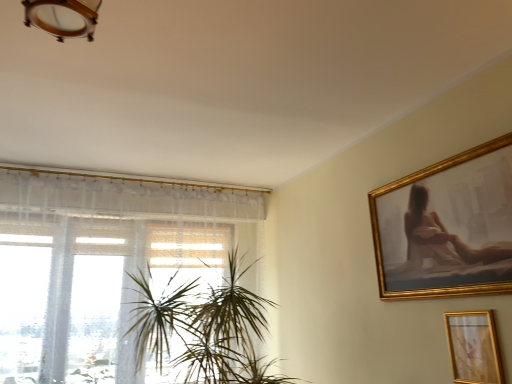
Question: Can you confirm if gold metallic picture frame at lower right is taller than green leafy plant at center?

Choices:
 (A) no
 (B) yes

Answer: (A)

Question: Is gold metallic picture frame at lower right surrounding green leafy plant at center?

Choices:
 (A) yes
 (B) no

Answer: (B)

Question: Are gold metallic picture frame at lower right and green leafy plant at center far apart?

Choices:
 (A) yes
 (B) no

Answer: (A)

Question: Considering the relative sizes of gold metallic picture frame at lower right and green leafy plant at center in the image provided, is gold metallic picture frame at lower right shorter than green leafy plant at center?

Choices:
 (A) yes
 (B) no

Answer: (A)

Question: Is gold metallic picture frame at lower right closer to the viewer compared to green leafy plant at center?

Choices:
 (A) yes
 (B) no

Answer: (A)

Question: Is gold metallic picture frame at lower right bigger than green leafy plant at center?

Choices:
 (A) no
 (B) yes

Answer: (A)

Question: From a real-world perspective, is green leafy plant at center located higher than gold metallic picture frame at lower right?

Choices:
 (A) yes
 (B) no

Answer: (A)

Question: Does green leafy plant at center come behind gold metallic picture frame at lower right?

Choices:
 (A) yes
 (B) no

Answer: (A)

Question: Does green leafy plant at center lie in front of gold metallic picture frame at lower right?

Choices:
 (A) no
 (B) yes

Answer: (A)

Question: Considering the relative sizes of green leafy plant at center and gold metallic picture frame at lower right in the image provided, is green leafy plant at center taller than gold metallic picture frame at lower right?

Choices:
 (A) yes
 (B) no

Answer: (A)

Question: Is green leafy plant at center outside gold metallic picture frame at lower right?

Choices:
 (A) no
 (B) yes

Answer: (B)

Question: Is green leafy plant at center far away from gold metallic picture frame at lower right?

Choices:
 (A) no
 (B) yes

Answer: (B)

Question: Can you confirm if green leafy plant at center is positioned to the left of white sheer curtain at left?

Choices:
 (A) no
 (B) yes

Answer: (A)